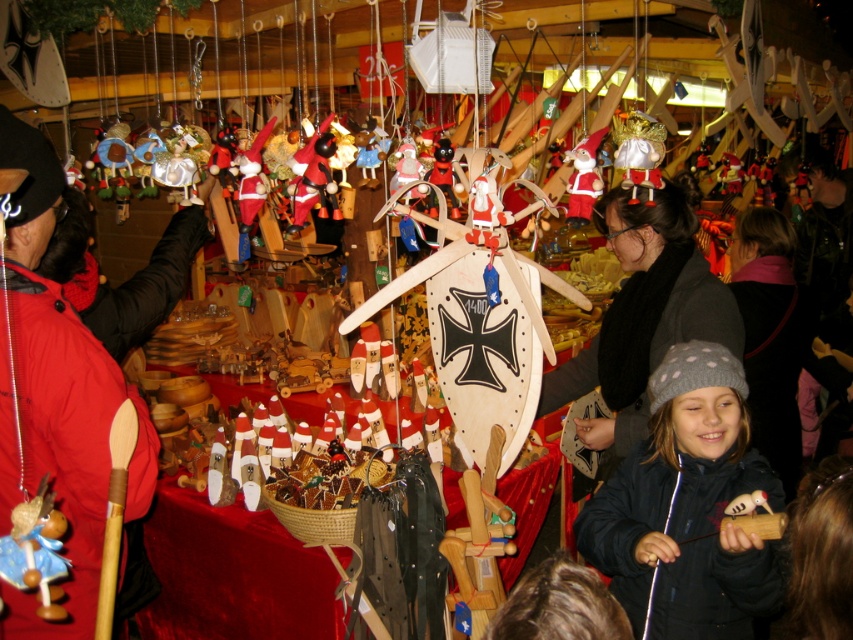
Can you confirm if red woolen hat at upper center is positioned to the left of gray knit hat at center?

Indeed, red woolen hat at upper center is positioned on the left side of gray knit hat at center.

Is point (93, 356) closer to viewer compared to point (664, 252)?

Yes, it is.

You are a GUI agent. You are given a task and a screenshot of the screen. Output one action in this format:
    pyautogui.click(x=<x>, y=<y>)
    Task: Click on the red woolen hat at upper center
    
    Given the screenshot: What is the action you would take?
    pyautogui.click(x=49, y=388)

Looking at this image, is wooden shield at center thinner than velvet santa at center?

No.

Is wooden shield at center to the right of velvet santa at center from the viewer's perspective?

Incorrect, wooden shield at center is not on the right side of velvet santa at center.

Where is `wooden shield at center`? Image resolution: width=853 pixels, height=640 pixels. wooden shield at center is located at coordinates (482, 330).

Between gray knitted hat at lower right and gray knit hat at center, which one has more height?

With more height is gray knit hat at center.

How far apart are gray knitted hat at lower right and gray knit hat at center?

The distance of gray knitted hat at lower right from gray knit hat at center is 18.76 inches.

Is point (729, 428) behind point (669, 289)?

No, (729, 428) is in front of (669, 289).

Image resolution: width=853 pixels, height=640 pixels. I want to click on gray knitted hat at lower right, so click(x=688, y=508).